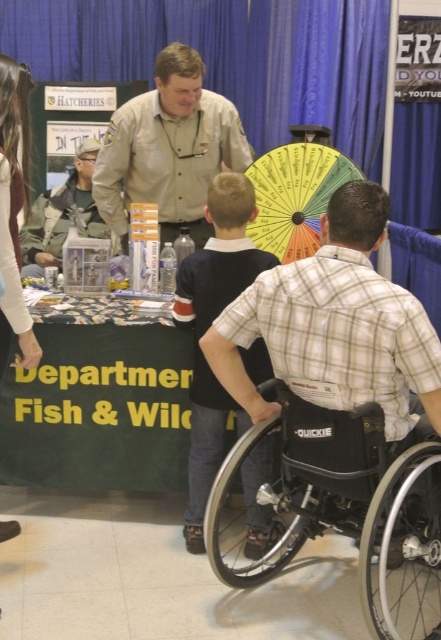
Between point (328, 410) and point (119, 301), which one is positioned in front?

Point (328, 410) is more forward.

Who is taller, black plastic wheelchair at lower center or green fabric sign at lower center?

Standing taller between the two is green fabric sign at lower center.

Who is more forward, (280,496) or (53,435)?

Point (280,496) is in front.

This screenshot has width=441, height=640. In order to click on black plastic wheelchair at lower center in this screenshot , I will do `click(346, 506)`.

Who is higher up, plaid fabric shirt at center or camouflage jacket at left?

Positioned higher is camouflage jacket at left.

Between point (374, 320) and point (83, 170), which one is positioned behind?

Point (83, 170)

Locate an element on the screen. This screenshot has width=441, height=640. plaid fabric shirt at center is located at coordinates (335, 324).

Does khaki uniform shirt at center have a smaller size compared to yellow fabric umbrella at center?

Incorrect, khaki uniform shirt at center is not smaller in size than yellow fabric umbrella at center.

Can you confirm if khaki uniform shirt at center is bigger than yellow fabric umbrella at center?

Correct, khaki uniform shirt at center is larger in size than yellow fabric umbrella at center.

I want to click on khaki uniform shirt at center, so click(168, 148).

The width and height of the screenshot is (441, 640). I want to click on khaki uniform shirt at center, so click(x=168, y=148).